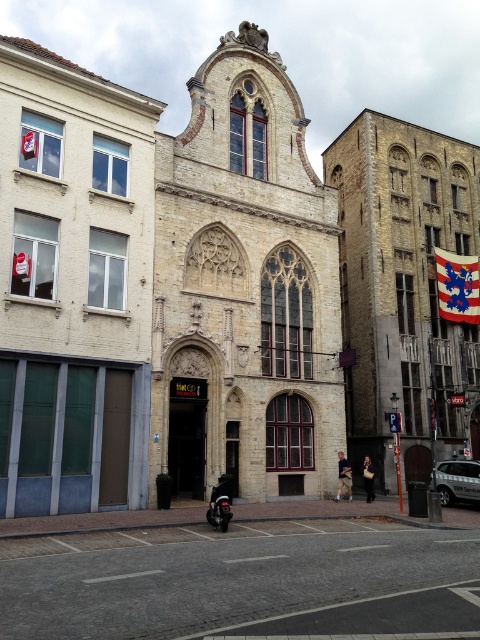
You are a tourist visiting the historic site and want to take a photo of the beige stone church at center and the shiny black motorcycle at center. However, due to the church being in front of the motorcycle, will the motorcycle be visible in the photo if you focus on the church?

The beige stone church at center is positioned over the shiny black motorcycle at center, so if you focus on the church, the motorcycle will be mostly or entirely blocked and not visible in the photo.

You are a photographer planning to take a picture of the yellow brick church at center and the metallic silver car at lower right. Which object should you focus on first if you want to capture both in a single frame without moving the camera?

You should focus on the yellow brick church at center first because it is positioned over the metallic silver car at lower right, meaning it is closer to the camera and would require proper focus before the car in the background.